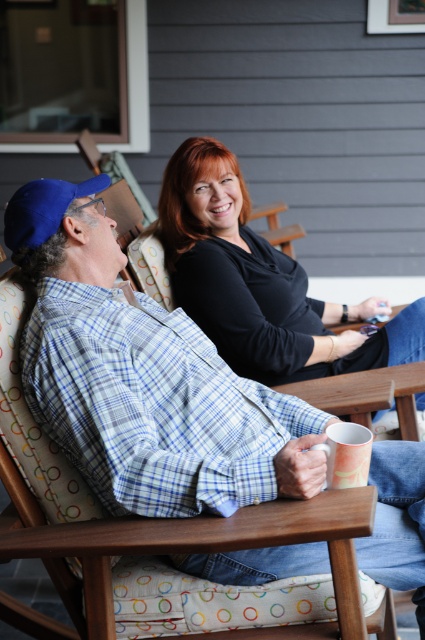
Question: Observing the image, what is the correct spatial positioning of blue plaid shirt at upper left in reference to black matte shirt at upper center?

Choices:
 (A) below
 (B) above

Answer: (A)

Question: Which point is closer to the camera taking this photo?

Choices:
 (A) (209, 266)
 (B) (30, 209)

Answer: (B)

Question: Among these points, which one is farthest from the camera?

Choices:
 (A) (299, 376)
 (B) (116, 365)

Answer: (A)

Question: Among these objects, which one is nearest to the camera?

Choices:
 (A) black matte shirt at upper center
 (B) blue plaid shirt at upper left

Answer: (B)

Question: Does blue plaid shirt at upper left have a greater width compared to black matte shirt at upper center?

Choices:
 (A) yes
 (B) no

Answer: (A)

Question: Does blue plaid shirt at upper left have a larger size compared to black matte shirt at upper center?

Choices:
 (A) no
 (B) yes

Answer: (B)